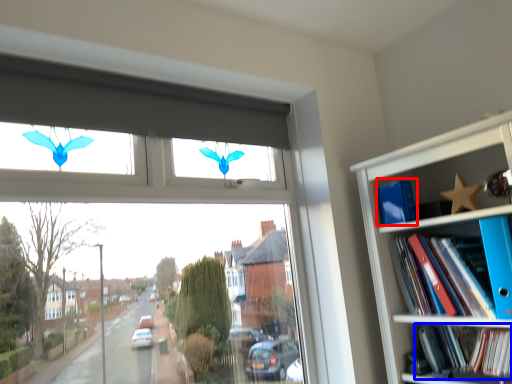
Question: Which object appears farthest to the camera in this image, paperback book (highlighted by a red box) or book (highlighted by a blue box)?

Choices:
 (A) paperback book
 (B) book

Answer: (A)